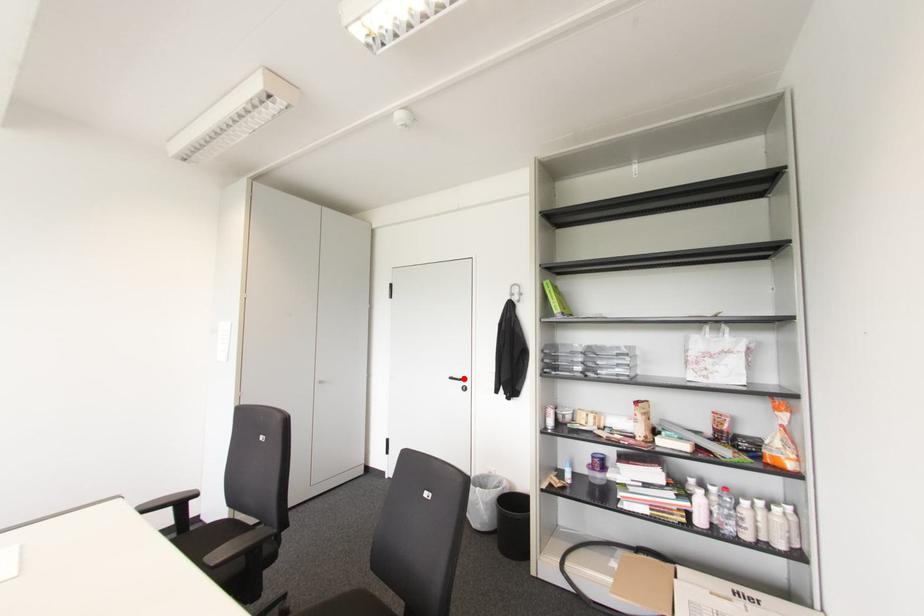
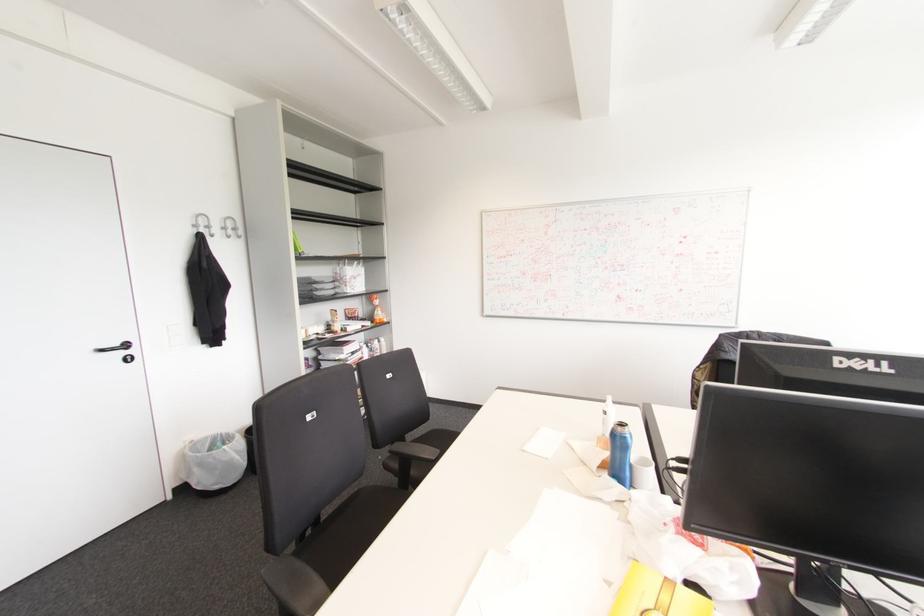
Locate, in the second image, the point that corresponds to the highlighted location in the first image.

(126, 345)